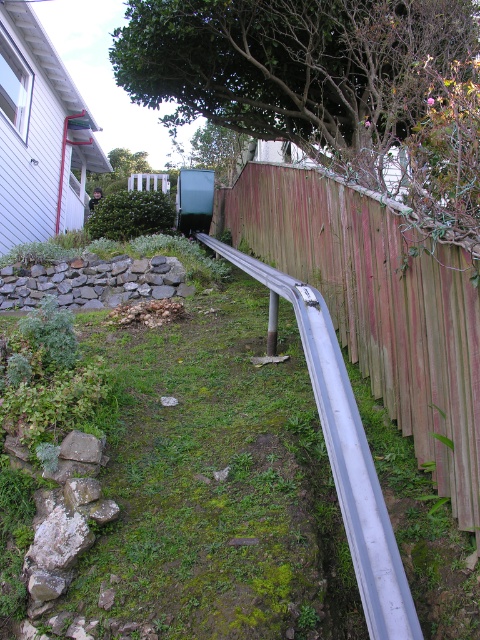
Who is shorter, silver metallic rail at right or gray stone wall at center-left?

silver metallic rail at right

Can you confirm if silver metallic rail at right is wider than gray stone wall at center-left?

No.

Describe the element at coordinates (342, 451) in the screenshot. I see `silver metallic rail at right` at that location.

The width and height of the screenshot is (480, 640). Identify the location of silver metallic rail at right. (342, 451).